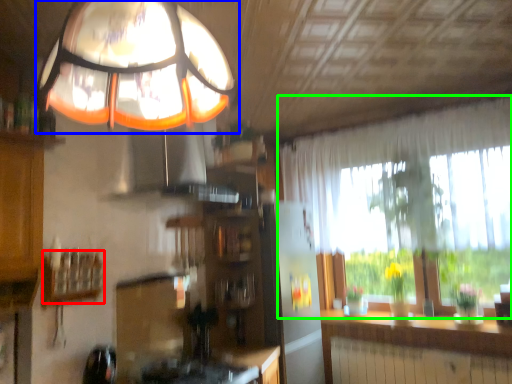
Question: Which is nearer to the shelf (highlighted by a red box)? lamp (highlighted by a blue box) or window (highlighted by a green box).

Choices:
 (A) lamp
 (B) window

Answer: (A)